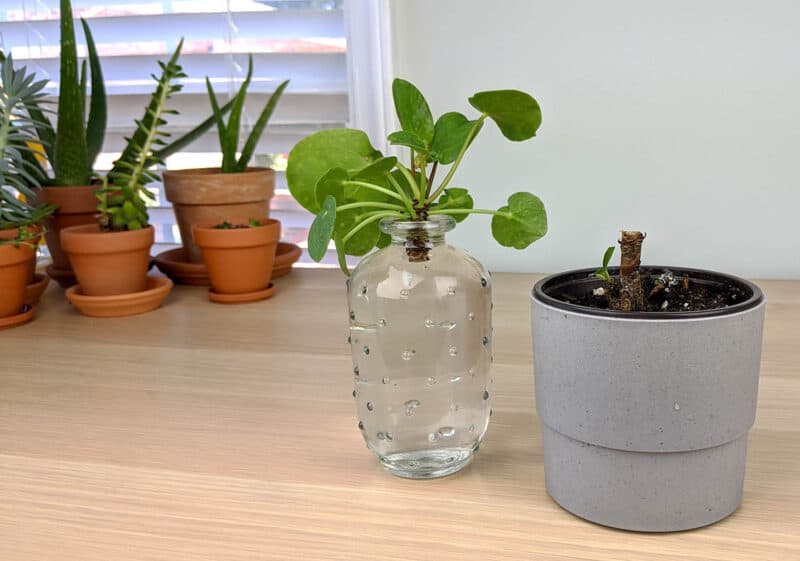
This screenshot has width=800, height=561. Find the location of `desk`. desk is located at coordinates (294, 504).